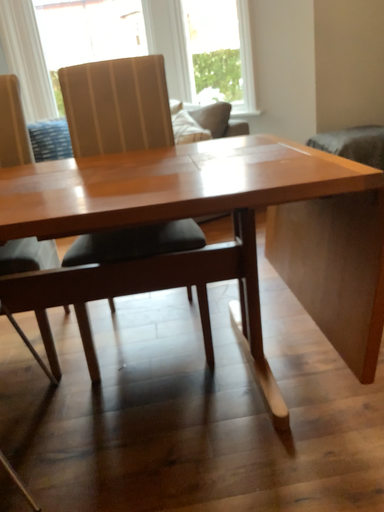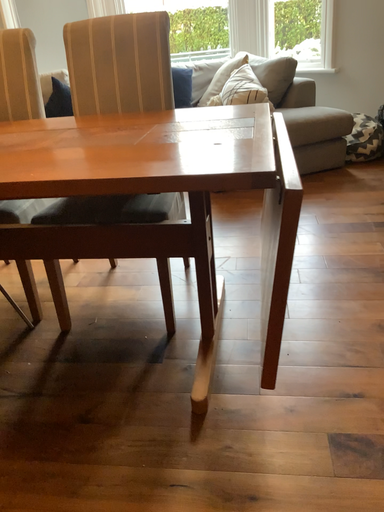
Question: How did the camera likely rotate when shooting the video?

Choices:
 (A) rotated right
 (B) rotated left

Answer: (B)